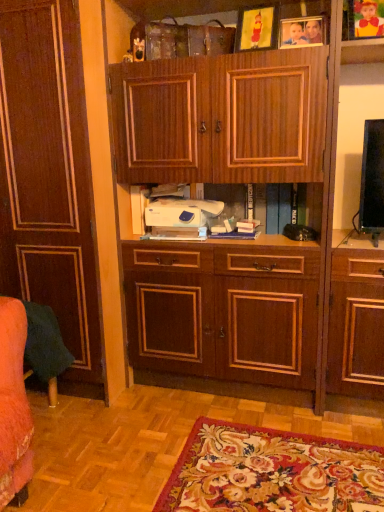
Question: From the image's perspective, relative to wooden picture frame at upper right, which is the first picture frame in right-to-left order, is yellow paper picture frame at upper center, which is counted as the first picture frame, starting from the left, above or below?

Choices:
 (A) above
 (B) below

Answer: (B)

Question: Is yellow paper picture frame at upper center, which is counted as the first picture frame, starting from the left, to the left or to the right of wooden picture frame at upper right, which appears as the 3th picture frame when viewed from the left, in the image?

Choices:
 (A) right
 (B) left

Answer: (B)

Question: Considering the real-world distances, which object is closest to the yellow paper picture frame at upper center, which is counted as the first picture frame, starting from the left?

Choices:
 (A) wooden picture frame at upper right, which appears as the 3th picture frame when viewed from the left
 (B) white plastic printer at center
 (C) matte wood cabinet at left
 (D) wooden picture frame at upper center, positioned as the second picture frame in left-to-right order

Answer: (D)

Question: Considering the real-world distances, which object is closest to the matte wood cabinet at left?

Choices:
 (A) yellow paper picture frame at upper center, which is counted as the first picture frame, starting from the left
 (B) wooden picture frame at upper center, arranged as the second picture frame when viewed from the right
 (C) white plastic printer at center
 (D) wooden picture frame at upper right, which is the first picture frame in right-to-left order

Answer: (C)